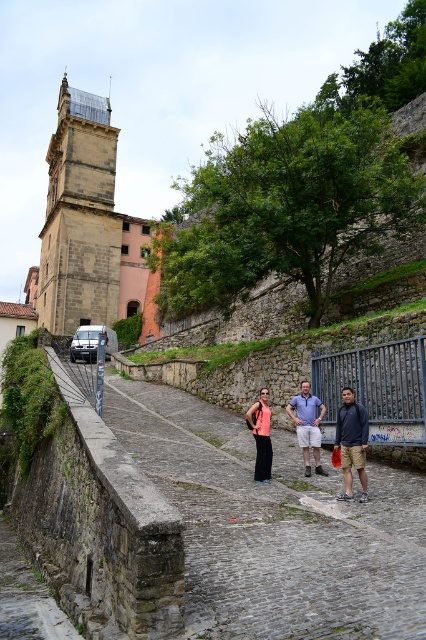
Is point (301, 400) positioned after point (259, 422)?

That is True.

Can you confirm if light blue denim shorts at center is positioned above matte coral top at center?

No.

Is point (301, 438) farther from viewer compared to point (264, 412)?

Yes, it is.

The height and width of the screenshot is (640, 426). Find the location of `light blue denim shorts at center`. light blue denim shorts at center is located at coordinates (307, 426).

Looking at this image, is cobblestone path at center below matte coral top at center?

Yes.

Between point (302, 465) and point (267, 416), which one is positioned in front?

Positioned in front is point (302, 465).

Is point (417, 634) more distant than point (265, 449)?

No, (417, 634) is in front of (265, 449).

You are a GUI agent. You are given a task and a screenshot of the screen. Output one action in this format:
    pyautogui.click(x=<x>, y=<y>)
    Task: Click on the cobblestone path at center
    This screenshot has width=426, height=640.
    Given the screenshot: What is the action you would take?
    pyautogui.click(x=273, y=528)

You are a GUI agent. You are given a task and a screenshot of the screen. Output one action in this format:
    pyautogui.click(x=<x>, y=<y>)
    Task: Click on the brown stone tower at upper left
    This screenshot has width=426, height=640.
    Given the screenshot: What is the action you would take?
    pyautogui.click(x=80, y=218)

Is brown stone tower at upper left bigger than dark blue hoodie at center?

Yes.

Identify the location of brown stone tower at upper left. (80, 218).